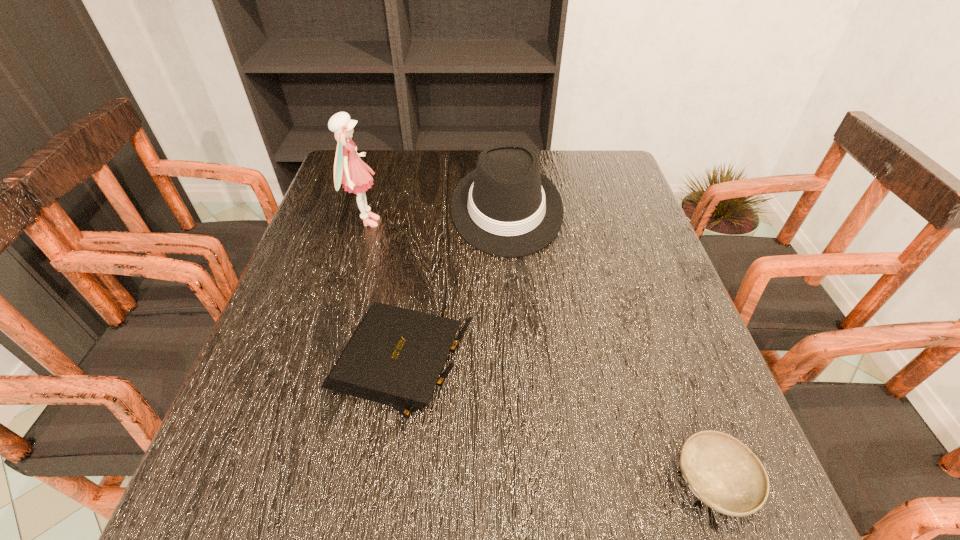
Find the location of a particular element. The image size is (960, 540). vacant space at the far right corner is located at coordinates (623, 174).

Locate an element on the screen. Image resolution: width=960 pixels, height=540 pixels. vacant space at the near right corner is located at coordinates (770, 516).

Identify the location of vacant space in between the rightmost object and the doll. This screenshot has height=540, width=960. (540, 352).

Find the location of `vacant space in between the third shortest object and the rightmost object`. vacant space in between the third shortest object and the rightmost object is located at coordinates (611, 345).

I want to click on vacant region between the router and the doll, so click(383, 295).

The image size is (960, 540). I want to click on free space that is in between the tallest object and the rightmost object, so click(x=540, y=352).

Where is `vacant space in between the fedora and the nearest object`? The width and height of the screenshot is (960, 540). vacant space in between the fedora and the nearest object is located at coordinates (611, 345).

The width and height of the screenshot is (960, 540). Find the location of `vacant area that lies between the tallest object and the nearest object`. vacant area that lies between the tallest object and the nearest object is located at coordinates (540, 352).

Locate an element on the screen. The width and height of the screenshot is (960, 540). vacant area that lies between the nearest object and the tallest object is located at coordinates (540, 352).

The image size is (960, 540). In order to click on vacant region between the nearest object and the doll in this screenshot , I will do `click(540, 352)`.